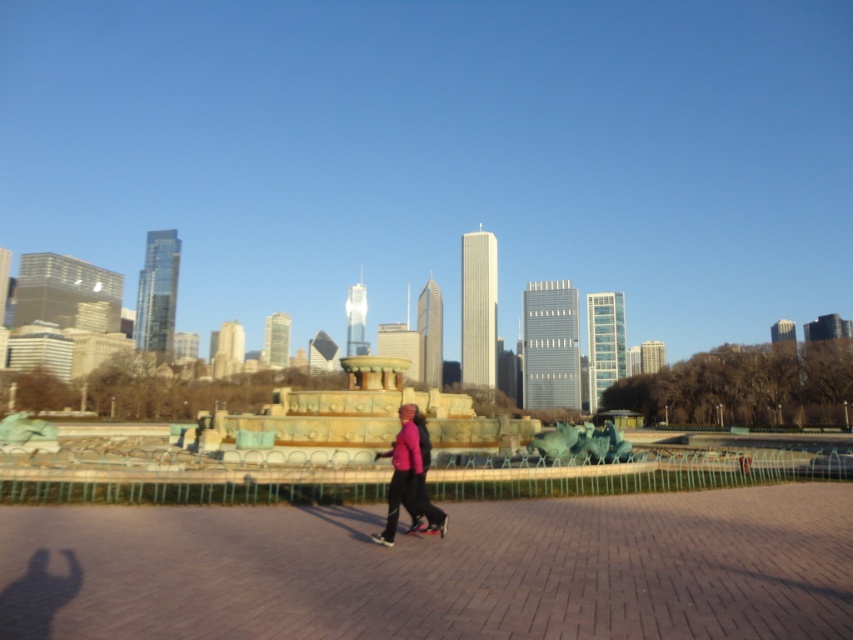
Question: Which object appears farthest from the camera in this image?

Choices:
 (A) brick pavement at center
 (B) pink matte jacket at center

Answer: (B)

Question: In this image, where is brick pavement at center located relative to pink matte jacket at center?

Choices:
 (A) below
 (B) above

Answer: (B)

Question: Does brick pavement at center appear on the left side of pink matte jacket at center?

Choices:
 (A) no
 (B) yes

Answer: (A)

Question: From the image, what is the correct spatial relationship of brick pavement at center in relation to pink matte jacket at center?

Choices:
 (A) above
 (B) below

Answer: (A)